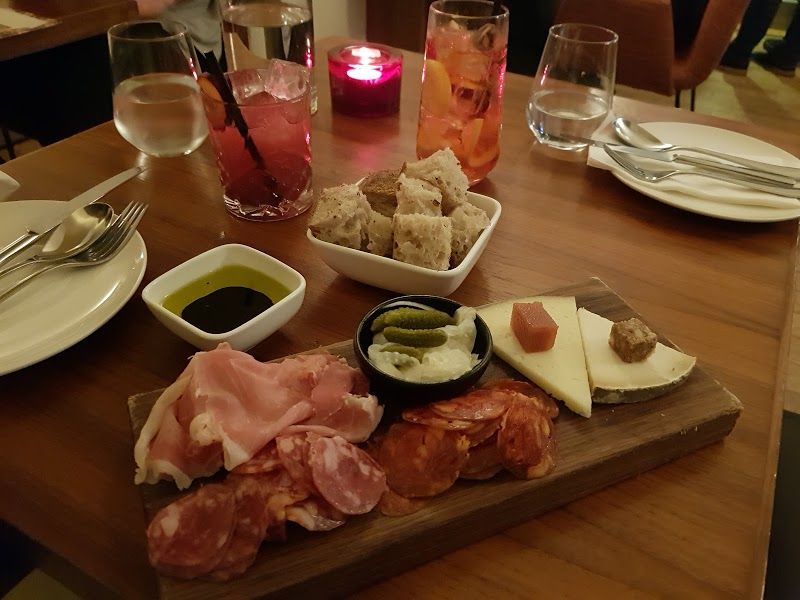
Locate an element on the screen. The width and height of the screenshot is (800, 600). glass of water is located at coordinates (138, 116), (556, 110).